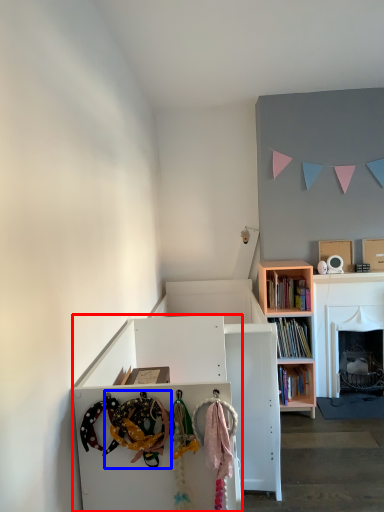
Question: Which of the following is the farthest to the observer, cabinetry (highlighted by a red box) or toy (highlighted by a blue box)?

Choices:
 (A) cabinetry
 (B) toy

Answer: (A)